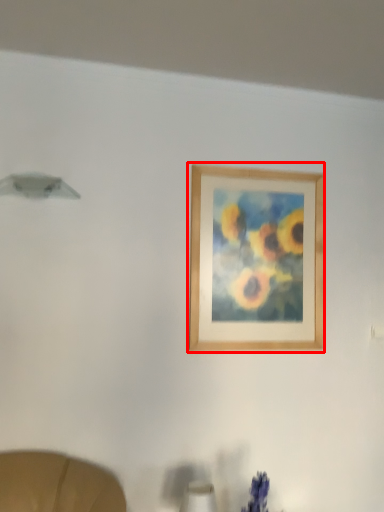
Question: From the image's perspective, where is picture frame (annotated by the red box) located in relation to table lamp in the image?

Choices:
 (A) below
 (B) above

Answer: (B)